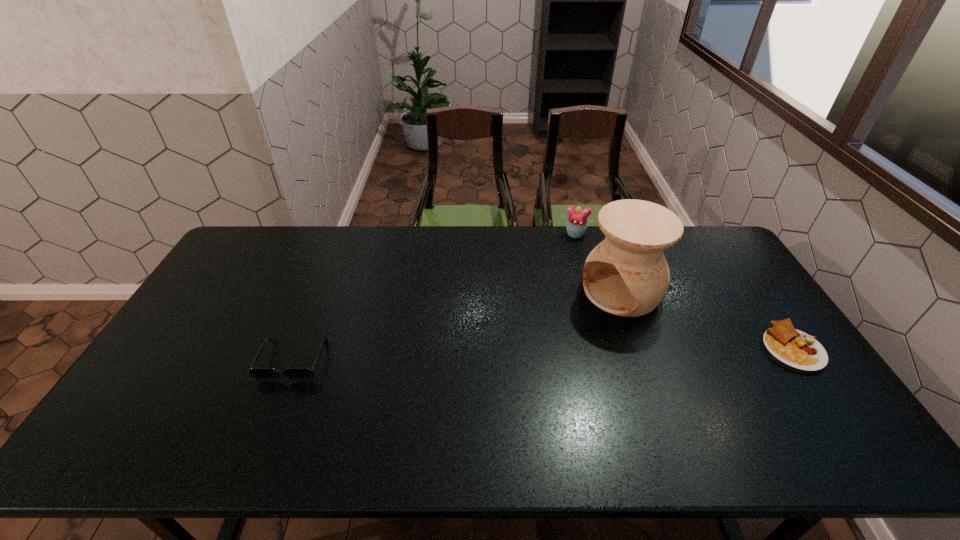
This screenshot has width=960, height=540. Find the location of `free region at the left edge`. free region at the left edge is located at coordinates (190, 321).

Find the location of a particular element. free region at the right edge of the desktop is located at coordinates 746,334.

Identify the location of vacant region at the far left corner of the desktop. The image size is (960, 540). (250, 242).

I want to click on vacant space at the far right corner of the desktop, so click(697, 243).

I want to click on free space between the omelet and the tallest object, so click(707, 320).

Locate an element on the screen. The height and width of the screenshot is (540, 960). free space between the omelet and the leftmost object is located at coordinates (542, 354).

At what (x,y) coordinates should I click in order to perform the action: click on free space between the omelet and the second farthest object. Please return your answer as a coordinate pair (x, y). Looking at the image, I should click on (707, 320).

You are a GUI agent. You are given a task and a screenshot of the screen. Output one action in this format:
    pyautogui.click(x=<x>, y=<y>)
    Task: Click on the vacant area that lies between the cupcake and the leftmost object
    
    Given the screenshot: What is the action you would take?
    pyautogui.click(x=434, y=297)

This screenshot has width=960, height=540. Identify the location of vacant region between the rightmost object and the third tallest object. (542, 354).

This screenshot has width=960, height=540. In order to click on vacant space in between the second farthest object and the third tallest object in this screenshot , I will do `click(458, 326)`.